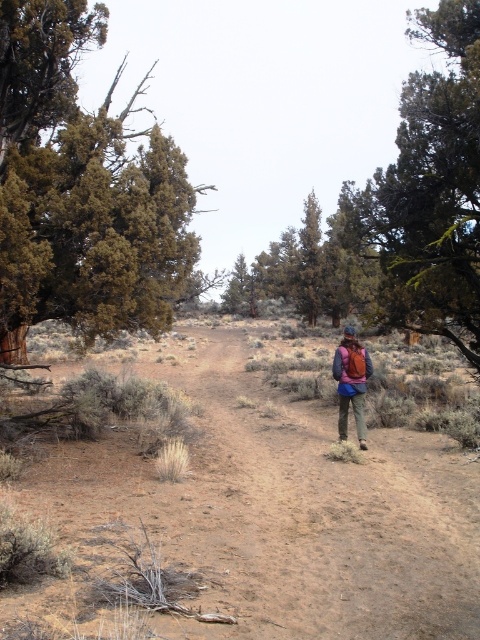
Question: Is brown dirt track at center smaller than green textured tree at right?

Choices:
 (A) yes
 (B) no

Answer: (A)

Question: Can you confirm if green textured tree at left is positioned above green textured tree at center?

Choices:
 (A) yes
 (B) no

Answer: (A)

Question: Can you confirm if green textured tree at left is positioned to the left of green textured tree at right?

Choices:
 (A) yes
 (B) no

Answer: (A)

Question: Which of the following is the farthest from the observer?

Choices:
 (A) (276, 289)
 (B) (469, 116)

Answer: (A)

Question: Estimate the real-world distances between objects in this image. Which object is farther from the matte brown backpack at center?

Choices:
 (A) green textured tree at center
 (B) green textured tree at left
 (C) brown dirt track at center
 (D) green textured tree at right

Answer: (A)

Question: Which point is farther to the camera?

Choices:
 (A) brown dirt track at center
 (B) green textured tree at left
 (C) green textured tree at right

Answer: (C)